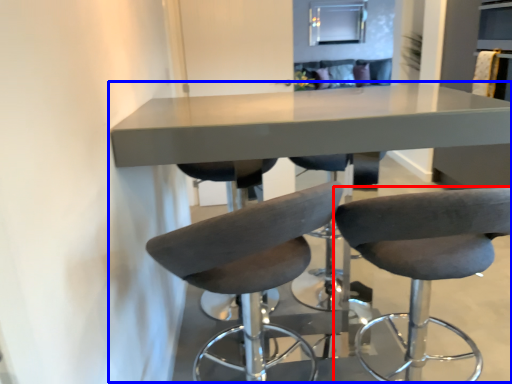
Question: Among these objects, which one is nearest to the camera, chair (highlighted by a red box) or table (highlighted by a blue box)?

Choices:
 (A) chair
 (B) table

Answer: (A)